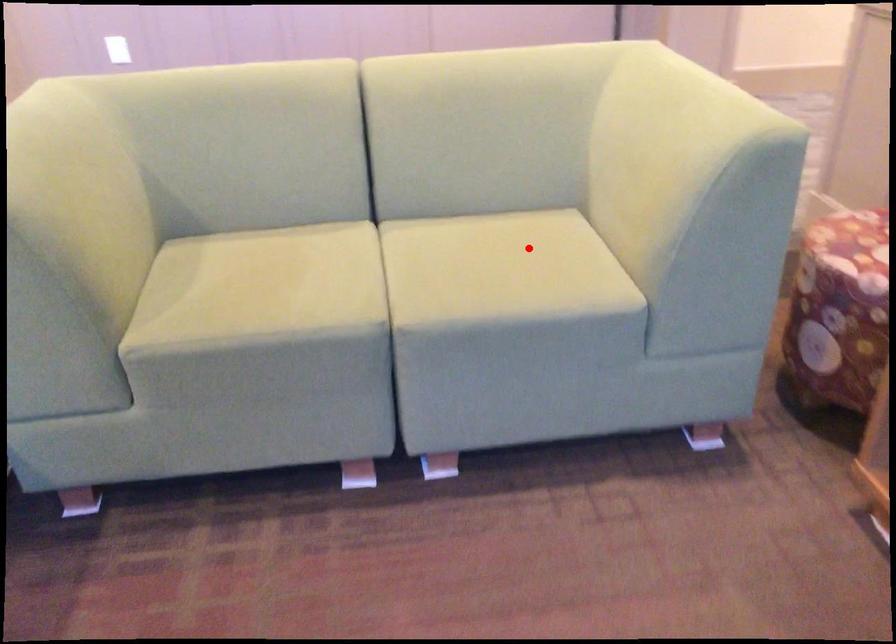
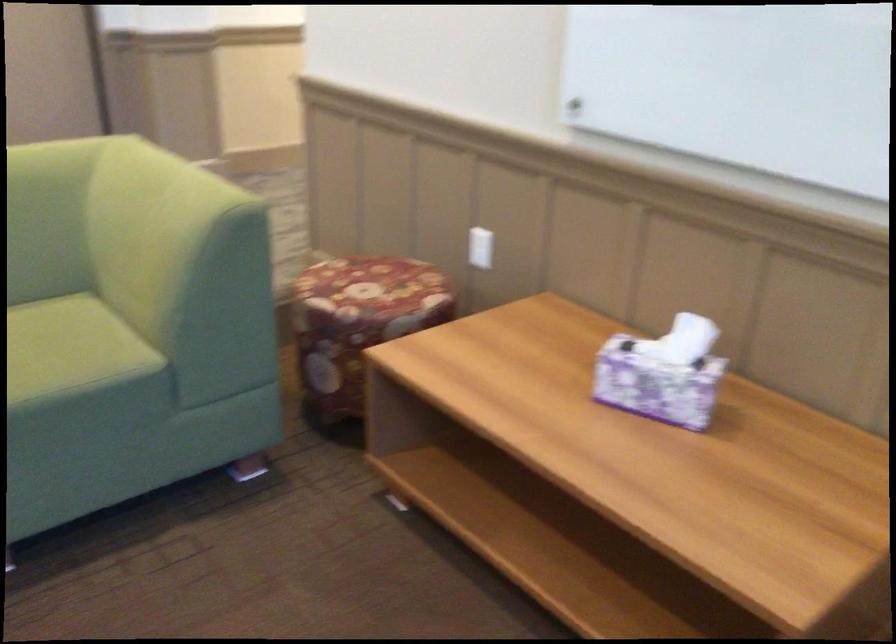
Where in the second image is the point corresponding to the highlighted location from the first image?

(46, 339)